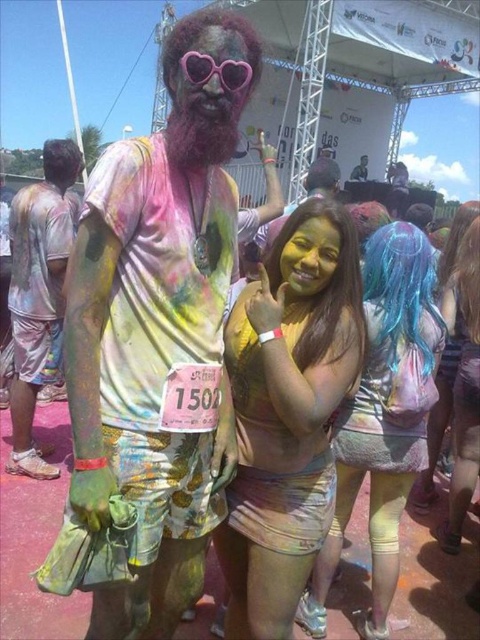
How distant is multicolored painted shirt at center from painted fabric shorts at left?

2.40 meters

Is multicolored painted shirt at center behind painted fabric shorts at left?

No.

The width and height of the screenshot is (480, 640). What do you see at coordinates (158, 333) in the screenshot?
I see `multicolored painted shirt at center` at bounding box center [158, 333].

The width and height of the screenshot is (480, 640). I want to click on multicolored painted shirt at center, so click(158, 333).

Who is positioned more to the right, multicolored painted shirt at center or pink matte heart-shaped sunglasses at center?

Positioned to the right is pink matte heart-shaped sunglasses at center.

Is multicolored painted shirt at center wider than pink matte heart-shaped sunglasses at center?

Yes, multicolored painted shirt at center is wider than pink matte heart-shaped sunglasses at center.

Identify the location of multicolored painted shirt at center. (158, 333).

Where is `multicolored painted shirt at center`? The width and height of the screenshot is (480, 640). multicolored painted shirt at center is located at coordinates coord(158,333).

Which is above, pink matte heart-shaped sunglasses at center or pastel tie-dye dress at center?

pink matte heart-shaped sunglasses at center is above.

Is point (228, 35) positioned after point (456, 369)?

No.

The image size is (480, 640). Find the location of `pink matte heart-shaped sunglasses at center`. pink matte heart-shaped sunglasses at center is located at coordinates (211, 84).